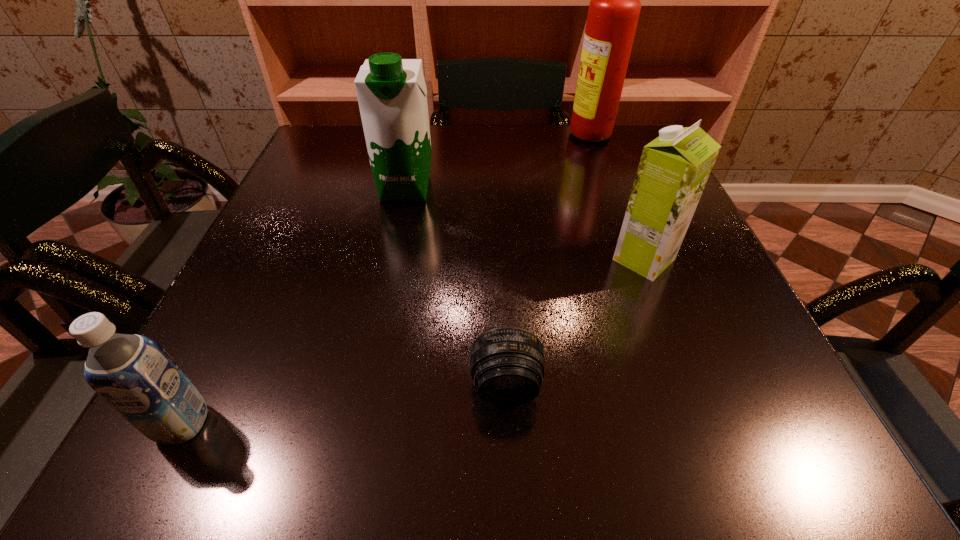
Find the location of a particular element. free space between the nearest soya milk and the shortest object is located at coordinates [344, 404].

The height and width of the screenshot is (540, 960). I want to click on object that stands as the closest to the third object from right to left, so click(x=674, y=168).

The width and height of the screenshot is (960, 540). I want to click on the closest object to the fire extinguisher, so click(x=674, y=168).

The height and width of the screenshot is (540, 960). Identify the location of soya milk that is the third closest one to the shortest object. point(392,95).

This screenshot has height=540, width=960. In order to click on soya milk that can be found as the second closest to the second nearest soya milk in this screenshot , I will do `click(132, 373)`.

Locate an element on the screen. free point that satisfies the following two spatial constraints: 1. on the front-facing side of the farthest object; 2. on the back side of the rightmost soya milk is located at coordinates (638, 259).

The width and height of the screenshot is (960, 540). I want to click on vacant space that satisfies the following two spatial constraints: 1. on the front-facing side of the rightmost soya milk; 2. on the right side of the second object from left to right, so click(391, 259).

The width and height of the screenshot is (960, 540). Identify the location of free space that satisfies the following two spatial constraints: 1. on the front-facing side of the farthest object; 2. on the right side of the rightmost soya milk. (638, 259).

Where is `vacant space that satisfies the following two spatial constraints: 1. on the front-facing side of the farthest object; 2. on the label of the leftmost object`? vacant space that satisfies the following two spatial constraints: 1. on the front-facing side of the farthest object; 2. on the label of the leftmost object is located at coordinates (701, 424).

You are a GUI agent. You are given a task and a screenshot of the screen. Output one action in this format:
    pyautogui.click(x=<x>, y=<y>)
    Task: Click on the vacant region that satisfies the following two spatial constraints: 1. on the front-facing side of the second farthest soya milk; 2. on the right side of the farthest object
    The width and height of the screenshot is (960, 540).
    Given the screenshot: What is the action you would take?
    pyautogui.click(x=638, y=259)